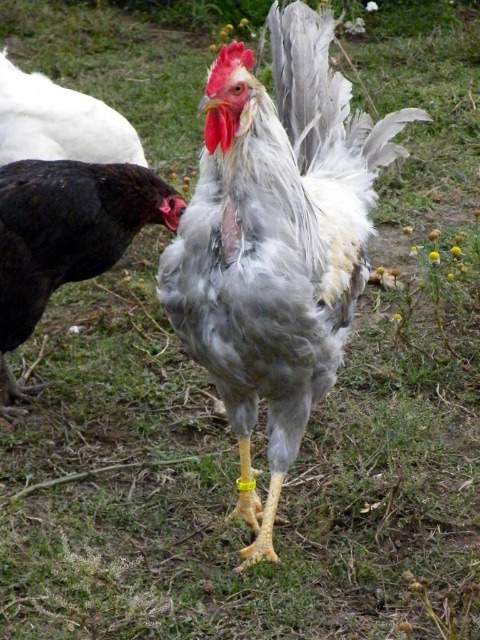
You are standing in a field and want to throw a small treat to the white feathered rooster at center. If your throwing range is 1.5 meters, will you be able to reach it?

The white feathered rooster at center is 1.54 meters away from the camera. Since your throwing range is 1.5 meters, you cannot reach it.

You are a farmer checking on your chickens. You notice the white feathered rooster at center and the shiny black chicken at left. Which chicken is closer to you?

The white feathered rooster at center is closer to you because it is in front of the shiny black chicken at left.

You are a farmer observing two chickens in your yard. You see a white feathered rooster at center and a white feathered chicken at upper left. Which chicken is located to the right of the other?

The white feathered rooster at center is positioned on the right side of the white feathered chicken at upper left.